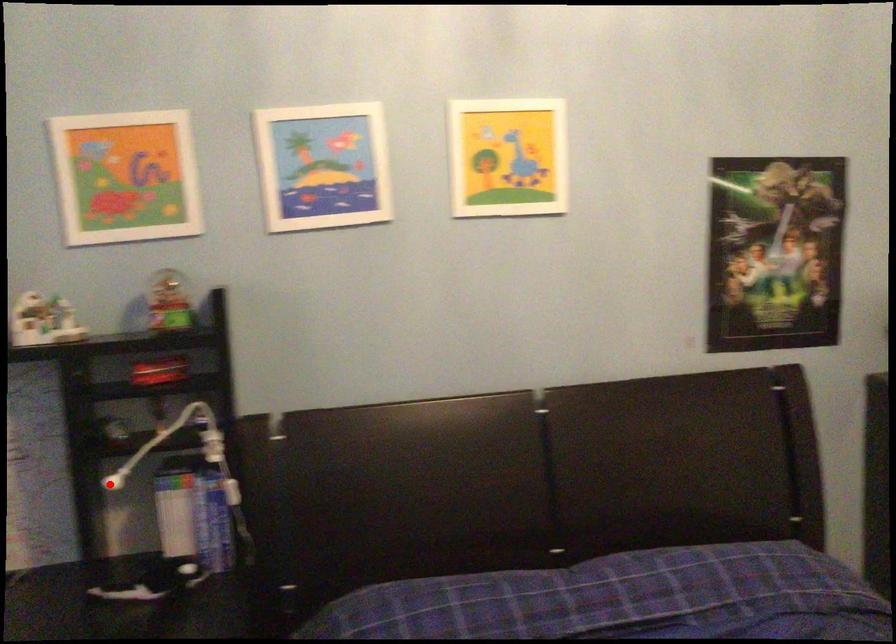
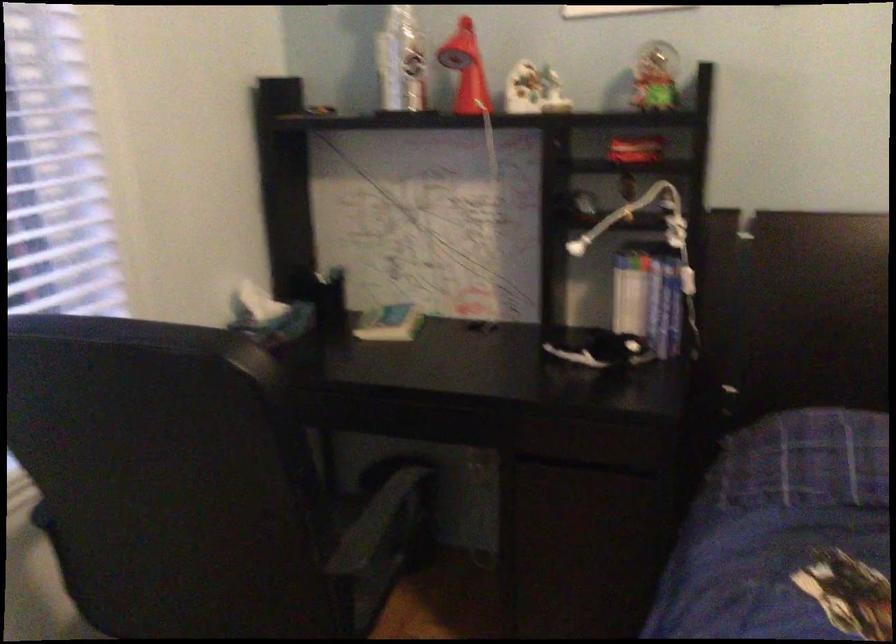
The point at the highlighted location is marked in the first image. Where is the corresponding point in the second image?

(576, 247)